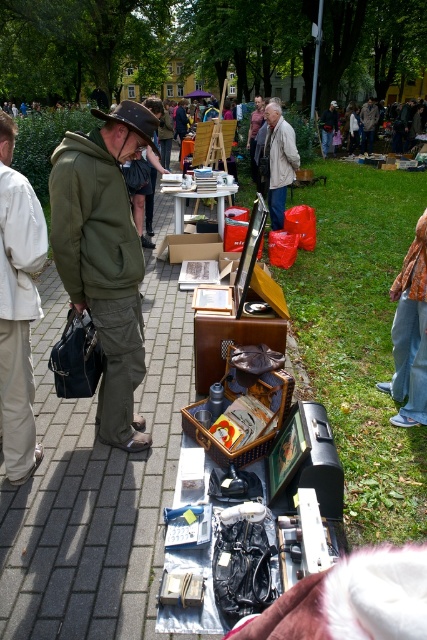
Question: Which object appears closest to the camera in this image?

Choices:
 (A) olive green hoodie at left
 (B) light beige jacket at center
 (C) light beige cotton pants at left

Answer: (C)

Question: Which is nearer to the light beige jacket at center?

Choices:
 (A) matte green jacket at left
 (B) olive green hoodie at left
 (C) light beige cotton pants at left

Answer: (A)

Question: Does olive green hoodie at left appear on the right side of light beige jacket at center?

Choices:
 (A) yes
 (B) no

Answer: (B)

Question: Does matte green jacket at left have a larger size compared to olive green hoodie at left?

Choices:
 (A) yes
 (B) no

Answer: (A)

Question: Is light beige cotton pants at left to the right of light beige jacket at center from the viewer's perspective?

Choices:
 (A) no
 (B) yes

Answer: (A)

Question: Based on their relative distances, which object is nearer to the matte green jacket at left?

Choices:
 (A) light beige jacket at center
 (B) light beige cotton pants at left
 (C) olive green hoodie at left

Answer: (C)